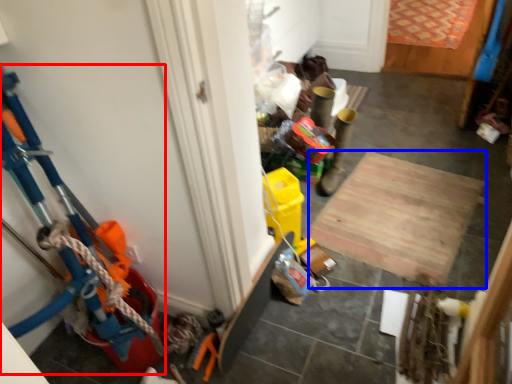
Question: Among these objects, which one is farthest to the camera, toy (highlighted by a red box) or plywood (highlighted by a blue box)?

Choices:
 (A) toy
 (B) plywood

Answer: (B)